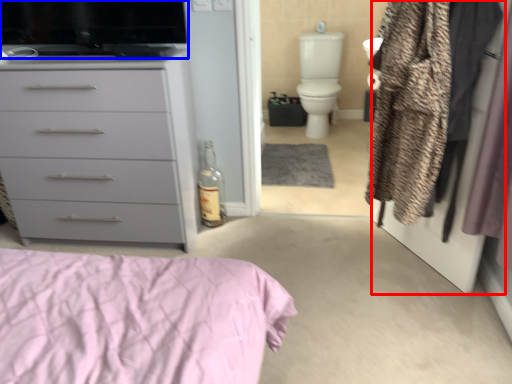
Question: Which object appears farthest to the camera in this image, screen door (highlighted by a red box) or appliance (highlighted by a blue box)?

Choices:
 (A) screen door
 (B) appliance

Answer: (B)